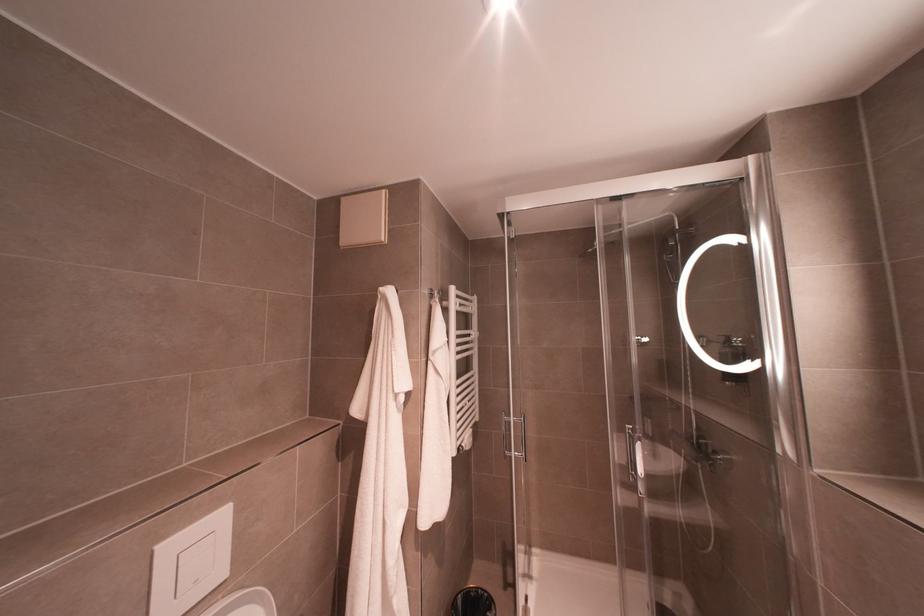
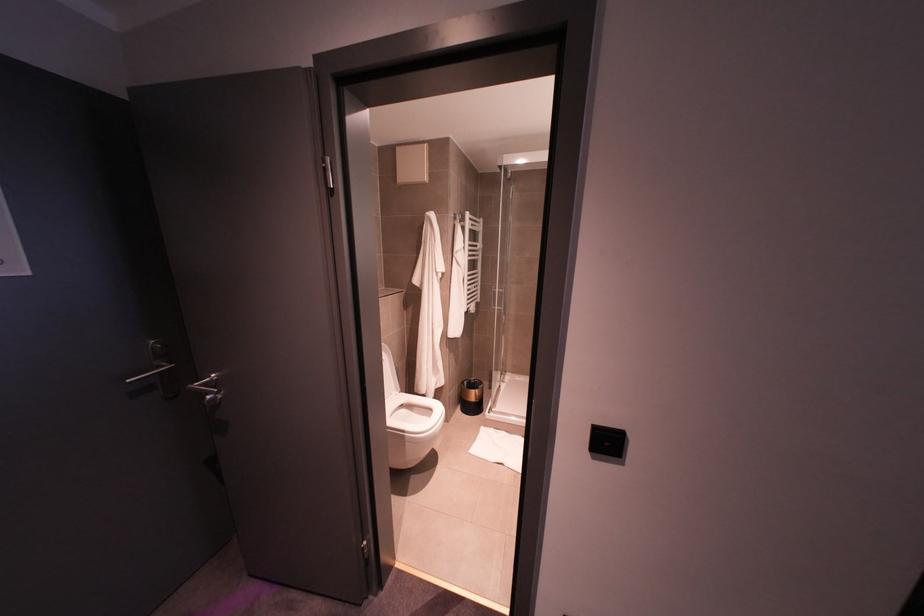
Where in the second image is the point corresponding to [511,451] from the first image?

(494, 305)